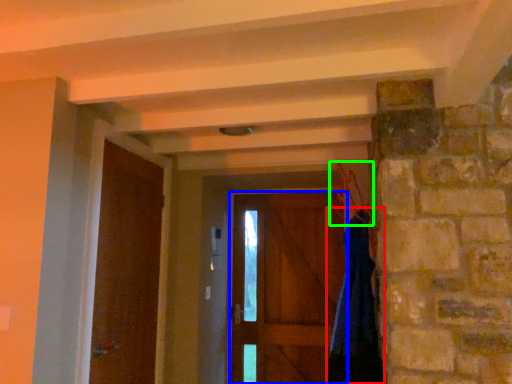
Question: Which object is the farthest from dress (highlighted by a red box)? Choose among these: door (highlighted by a blue box) or hanger (highlighted by a green box).

Choices:
 (A) door
 (B) hanger

Answer: (A)